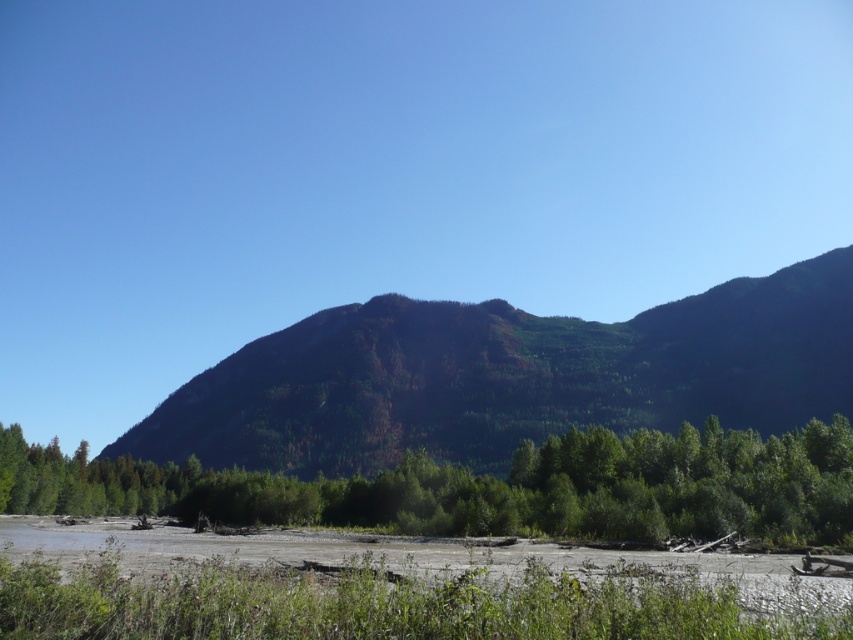
Between green forested mountain at center and green leafy trees at lower center, which one has more height?

green forested mountain at center

Can you confirm if green forested mountain at center is positioned to the right of green leafy trees at lower center?

Indeed, green forested mountain at center is positioned on the right side of green leafy trees at lower center.

Measure the distance between point (262, 448) and camera.

158.91 meters

Identify the location of green forested mountain at center. (509, 376).